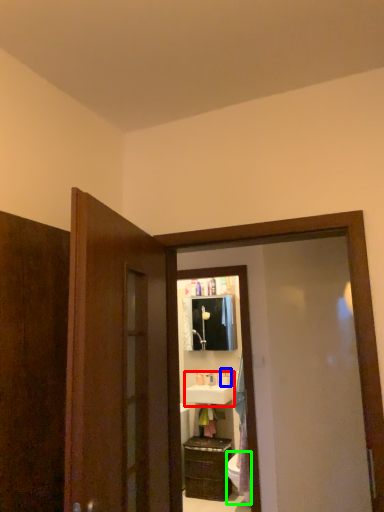
Question: Which object is the closest to the sink (highlighted by a red box)? Choose among these: toiletry (highlighted by a blue box) or toilet bowl (highlighted by a green box).

Choices:
 (A) toiletry
 (B) toilet bowl

Answer: (A)